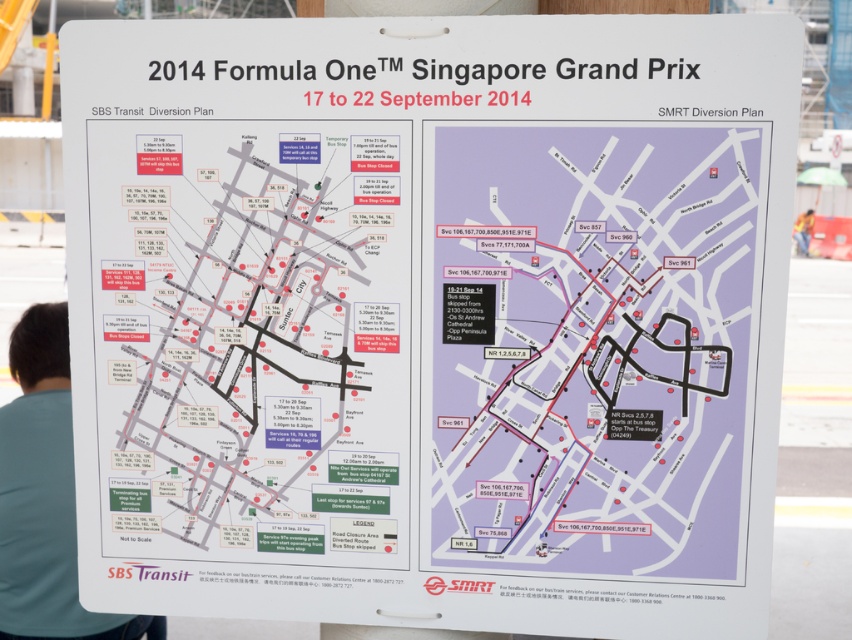
Who is positioned more to the left, purple paper map at center or blue fabric shirt at lower left?

From the viewer's perspective, blue fabric shirt at lower left appears more on the left side.

Who is more distant from viewer, (534, 173) or (39, 612)?

The point (39, 612) is behind.

Locate an element on the screen. The width and height of the screenshot is (852, 640). purple paper map at center is located at coordinates (591, 346).